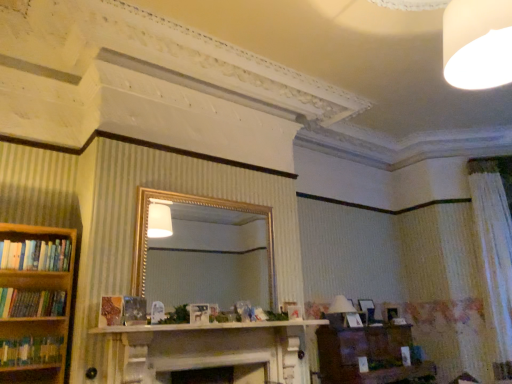
How much space does hardcover books at left, marked as the 1th book in a bottom-to-top arrangement, occupy horizontally?

hardcover books at left, marked as the 1th book in a bottom-to-top arrangement, is 8.38 inches in width.

What do you see at coordinates (36, 255) in the screenshot? I see `hardcover books at left, the 3th book positioned from the bottom` at bounding box center [36, 255].

What do you see at coordinates (367, 355) in the screenshot? The height and width of the screenshot is (384, 512). I see `brown wooden vanity at lower right` at bounding box center [367, 355].

Image resolution: width=512 pixels, height=384 pixels. Describe the element at coordinates (341, 306) in the screenshot. I see `white fabric lampshade at lower right` at that location.

What do you see at coordinates (31, 303) in the screenshot?
I see `hardcover books at left, which is the 2th book from top to bottom` at bounding box center [31, 303].

What do you see at coordinates (494, 255) in the screenshot?
I see `white textured curtain at right` at bounding box center [494, 255].

The width and height of the screenshot is (512, 384). I want to click on hardcover books at left, marked as the 1th book in a bottom-to-top arrangement, so click(30, 351).

Considering the relative sizes of hardcover books at left, which is counted as the 2th book, starting from the bottom, and hardcover books at left, the 3th book positioned from the bottom, in the image provided, is hardcover books at left, which is counted as the 2th book, starting from the bottom, shorter than hardcover books at left, the 3th book positioned from the bottom,?

No, hardcover books at left, which is counted as the 2th book, starting from the bottom, is not shorter than hardcover books at left, the 3th book positioned from the bottom.

From a real-world perspective, does hardcover books at left, which is counted as the 2th book, starting from the bottom, stand above hardcover books at left, the 3th book positioned from the bottom?

No, from a real-world perspective, hardcover books at left, which is counted as the 2th book, starting from the bottom, is not over hardcover books at left, the 3th book positioned from the bottom

Is point (64, 310) closer to viewer compared to point (10, 256)?

No, it is not.

From the image's perspective, is white fabric lampshade at lower right under brown wooden vanity at lower right?

Incorrect, from the image's perspective, white fabric lampshade at lower right is higher than brown wooden vanity at lower right.

Do you think white fabric lampshade at lower right is within brown wooden vanity at lower right, or outside of it?

white fabric lampshade at lower right cannot be found inside brown wooden vanity at lower right.

Does point (333, 300) appear closer or farther from the camera than point (369, 346)?

Point (333, 300) is farther from the camera than point (369, 346).

Looking at this image, between white fabric lampshade at lower right and brown wooden vanity at lower right, which one has larger width?

brown wooden vanity at lower right is wider.

From the image's perspective, would you say white fabric lampshade at lower right is positioned over hardcover books at left, the 1th book in the top-to-bottom sequence?

No, from the image's perspective, white fabric lampshade at lower right is not on top of hardcover books at left, the 1th book in the top-to-bottom sequence.

Considering the sizes of objects white fabric lampshade at lower right and hardcover books at left, the 3th book positioned from the bottom, in the image provided, who is smaller, white fabric lampshade at lower right or hardcover books at left, the 3th book positioned from the bottom,?

hardcover books at left, the 3th book positioned from the bottom.

Is white fabric lampshade at lower right spatially inside hardcover books at left, the 1th book in the top-to-bottom sequence, or outside of it?

white fabric lampshade at lower right is outside hardcover books at left, the 1th book in the top-to-bottom sequence.

How different are the orientations of white fabric lampshade at lower right and hardcover books at left, the 3th book positioned from the bottom, in degrees?

The angular difference between white fabric lampshade at lower right and hardcover books at left, the 3th book positioned from the bottom, is 3.17 degrees.

Based on the photo, does white textured curtain at right have a smaller size compared to white frosted bulb at upper right?

Incorrect, white textured curtain at right is not smaller in size than white frosted bulb at upper right.

Looking at their sizes, would you say white textured curtain at right is wider or thinner than white frosted bulb at upper right?

In the image, white textured curtain at right appears to be more narrow than white frosted bulb at upper right.

Is point (487, 238) closer to camera compared to point (453, 9)?

No.

Does white textured curtain at right contain white frosted bulb at upper right?

No.

From a real-world perspective, is hardcover books at left, the 1th book in the top-to-bottom sequence, on top of brown wooden vanity at lower right?

Correct, in the physical world, hardcover books at left, the 1th book in the top-to-bottom sequence, is higher than brown wooden vanity at lower right.

Could you measure the distance between hardcover books at left, the 1th book in the top-to-bottom sequence, and brown wooden vanity at lower right?

The distance of hardcover books at left, the 1th book in the top-to-bottom sequence, from brown wooden vanity at lower right is 3.22 meters.

Considering the sizes of hardcover books at left, the 3th book positioned from the bottom, and brown wooden vanity at lower right in the image, is hardcover books at left, the 3th book positioned from the bottom, taller or shorter than brown wooden vanity at lower right?

Considering their sizes, hardcover books at left, the 3th book positioned from the bottom, has less height than brown wooden vanity at lower right.

You are a GUI agent. You are given a task and a screenshot of the screen. Output one action in this format:
    pyautogui.click(x=<x>, y=<y>)
    Task: Click on the book that is the 1st object located in front of the brown wooden vanity at lower right
    
    Given the screenshot: What is the action you would take?
    pyautogui.click(x=36, y=255)

Considering the relative sizes of brown wooden vanity at lower right and hardcover books at left, the 3th book positioned from the bottom, in the image provided, is brown wooden vanity at lower right taller than hardcover books at left, the 3th book positioned from the bottom,?

Yes, brown wooden vanity at lower right is taller than hardcover books at left, the 3th book positioned from the bottom.

Considering the positions of objects brown wooden vanity at lower right and hardcover books at left, the 1th book in the top-to-bottom sequence, in the image provided, who is more to the right, brown wooden vanity at lower right or hardcover books at left, the 1th book in the top-to-bottom sequence,?

Positioned to the right is brown wooden vanity at lower right.

Based on the photo, measure the distance between brown wooden vanity at lower right and hardcover books at left, the 1th book in the top-to-bottom sequence.

10.57 feet.

Considering the points (396, 340) and (14, 242), which point is in front, point (396, 340) or point (14, 242)?

Positioned in front is point (14, 242).

From the image's perspective, is gold-framed mirror at center above hardcover books at left, which is counted as the 2th book, starting from the bottom?

Yes.

Is gold-framed mirror at center not within hardcover books at left, which is the 2th book from top to bottom?

Yes, gold-framed mirror at center is located beyond the bounds of hardcover books at left, which is the 2th book from top to bottom.

Does point (199, 207) come closer to viewer compared to point (15, 310)?

No, it is behind (15, 310).

Based on the photo, considering the sizes of gold-framed mirror at center and hardcover books at left, which is counted as the 2th book, starting from the bottom, in the image, is gold-framed mirror at center bigger or smaller than hardcover books at left, which is counted as the 2th book, starting from the bottom,?

Considering their sizes, gold-framed mirror at center takes up more space than hardcover books at left, which is counted as the 2th book, starting from the bottom.

You are a GUI agent. You are given a task and a screenshot of the screen. Output one action in this format:
    pyautogui.click(x=<x>, y=<y>)
    Task: Click on the book lying behind the hardcover books at left, which is counted as the 2th book, starting from the bottom
    The image size is (512, 384).
    Given the screenshot: What is the action you would take?
    36,255

Identify the location of lamp that appears on the left of brown wooden vanity at lower right. The width and height of the screenshot is (512, 384). (341, 306).

Estimate the real-world distances between objects in this image. Which object is closer to white frosted bulb at upper right, hardcover books at left, which is the 2th book from top to bottom, or brown wooden vanity at lower right?

Based on the image, hardcover books at left, which is the 2th book from top to bottom, appears to be nearer to white frosted bulb at upper right.

When comparing their distances from white fabric lampshade at lower right, does brown wooden vanity at lower right or white frosted bulb at upper right seem further?

Based on the image, white frosted bulb at upper right appears to be further to white fabric lampshade at lower right.

Based on the photo, based on their spatial positions, is white frosted bulb at upper right or white marble mantle at center closer to gold-framed mirror at center?

white marble mantle at center is positioned closer to the anchor gold-framed mirror at center.

From the picture: Which object lies further to the anchor point brown wooden vanity at lower right, hardcover books at left, which is counted as the 2th book, starting from the bottom, or hardcover books at left, the 1th book in the top-to-bottom sequence?

hardcover books at left, the 1th book in the top-to-bottom sequence, lies further to brown wooden vanity at lower right than the other object.

Looking at this image, based on their spatial positions, is hardcover books at left, the third book from the top, or gold-framed mirror at center closer to hardcover books at left, the 1th book in the top-to-bottom sequence?

Based on the image, hardcover books at left, the third book from the top, appears to be nearer to hardcover books at left, the 1th book in the top-to-bottom sequence.

From the image, which object appears to be farther from white frosted bulb at upper right, white marble mantle at center or white textured curtain at right?

Among the two, white textured curtain at right is located further to white frosted bulb at upper right.

Considering their positions, is gold-framed mirror at center positioned further to white textured curtain at right than brown wooden vanity at lower right?

gold-framed mirror at center is further to white textured curtain at right.

Estimate the real-world distances between objects in this image. Which object is closer to hardcover books at left, which is counted as the 2th book, starting from the bottom, hardcover books at left, the third book from the top, or white marble mantle at center?

Based on the image, hardcover books at left, the third book from the top, appears to be nearer to hardcover books at left, which is counted as the 2th book, starting from the bottom.

Image resolution: width=512 pixels, height=384 pixels. In order to click on mirror located between hardcover books at left, the 1th book in the top-to-bottom sequence, and white marble mantle at center in the left-right direction in this screenshot , I will do `click(209, 259)`.

The width and height of the screenshot is (512, 384). In order to click on curtain between white frosted bulb at upper right and brown wooden vanity at lower right in the vertical direction in this screenshot , I will do `click(494, 255)`.

Image resolution: width=512 pixels, height=384 pixels. I want to click on mirror between white frosted bulb at upper right and white marble mantle at center from top to bottom, so click(209, 259).

You are a GUI agent. You are given a task and a screenshot of the screen. Output one action in this format:
    pyautogui.click(x=<x>, y=<y>)
    Task: Click on the mantle situated between hardcover books at left, the third book from the top, and white textured curtain at right from left to right
    The height and width of the screenshot is (384, 512).
    Given the screenshot: What is the action you would take?
    pyautogui.click(x=207, y=326)